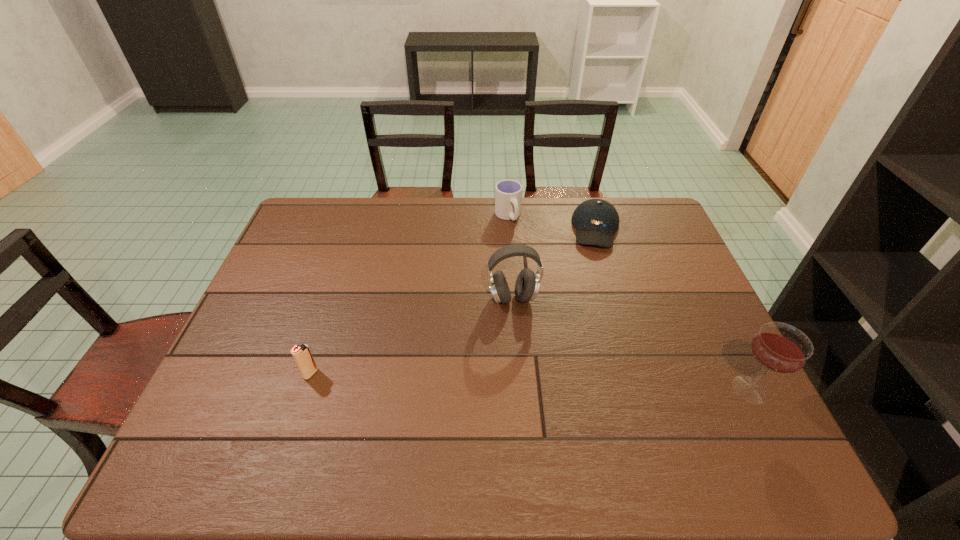
Locate an element on the screen. The width and height of the screenshot is (960, 540). vacant region located 0.250m on the ear cups of the headset is located at coordinates (521, 388).

You are a GUI agent. You are given a task and a screenshot of the screen. Output one action in this format:
    pyautogui.click(x=<x>, y=<y>)
    Task: Click on the vacant position located 0.300m with the handle on the side of the cup
    This screenshot has height=540, width=960.
    Given the screenshot: What is the action you would take?
    pyautogui.click(x=540, y=286)

Image resolution: width=960 pixels, height=540 pixels. Find the location of `vacant space located 0.060m with the handle on the side of the cup`. vacant space located 0.060m with the handle on the side of the cup is located at coordinates (516, 238).

This screenshot has width=960, height=540. Identify the location of free location located 0.250m with the handle on the side of the cup. (535, 275).

Find the location of a particular element. The height and width of the screenshot is (540, 960). free location located on the front-facing side of the fourth object from left to right is located at coordinates (598, 275).

You are a GUI agent. You are given a task and a screenshot of the screen. Output one action in this format:
    pyautogui.click(x=<x>, y=<y>)
    Task: Click on the vacant space located on the front-facing side of the fourth object from left to right
    This screenshot has width=960, height=540.
    Given the screenshot: What is the action you would take?
    pyautogui.click(x=596, y=338)

Identify the location of free region located on the front-facing side of the fourth object from left to right. The image size is (960, 540). (598, 264).

Identify the location of cup positioned at the far edge. Image resolution: width=960 pixels, height=540 pixels. (508, 193).

The height and width of the screenshot is (540, 960). I want to click on baseball cap situated at the far edge, so coord(596,220).

At what (x,y) coordinates should I click in order to perform the action: click on object at the near edge. Please return your answer as a coordinate pair (x, y). The height and width of the screenshot is (540, 960). Looking at the image, I should click on (778, 347).